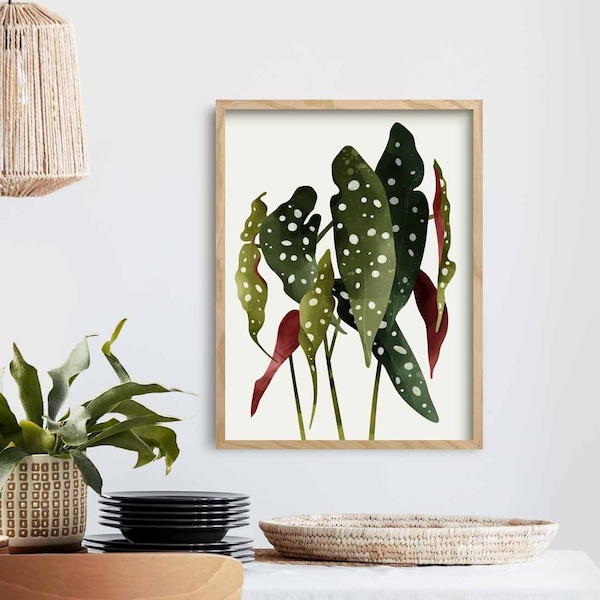
Find the location of a particular element. wicker basket is located at coordinates (430, 552).